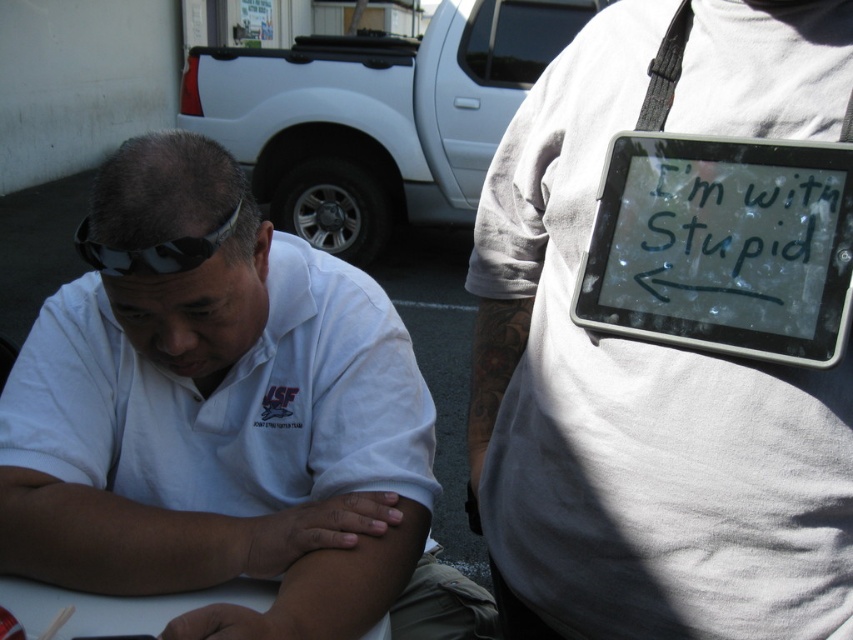
Question: Is white matte shirt at left above camouflage fabric goggles at upper left?

Choices:
 (A) no
 (B) yes

Answer: (A)

Question: Which point appears closest to the camera in this image?

Choices:
 (A) (618, 236)
 (B) (178, 237)
 (C) (50, 356)

Answer: (A)

Question: Is white matte shirt at left closer to the viewer compared to white matte tablet at upper right?

Choices:
 (A) yes
 (B) no

Answer: (B)

Question: Which point is closer to the camera?

Choices:
 (A) white matte table at lower left
 (B) white matte shirt at left
 (C) white matte tablet at upper right

Answer: (C)

Question: Which point is closer to the camera taking this photo?

Choices:
 (A) (740, 426)
 (B) (106, 616)
 (C) (653, 202)

Answer: (A)

Question: Can you confirm if white matte tablet at upper right is thinner than white matte table at lower left?

Choices:
 (A) no
 (B) yes

Answer: (B)